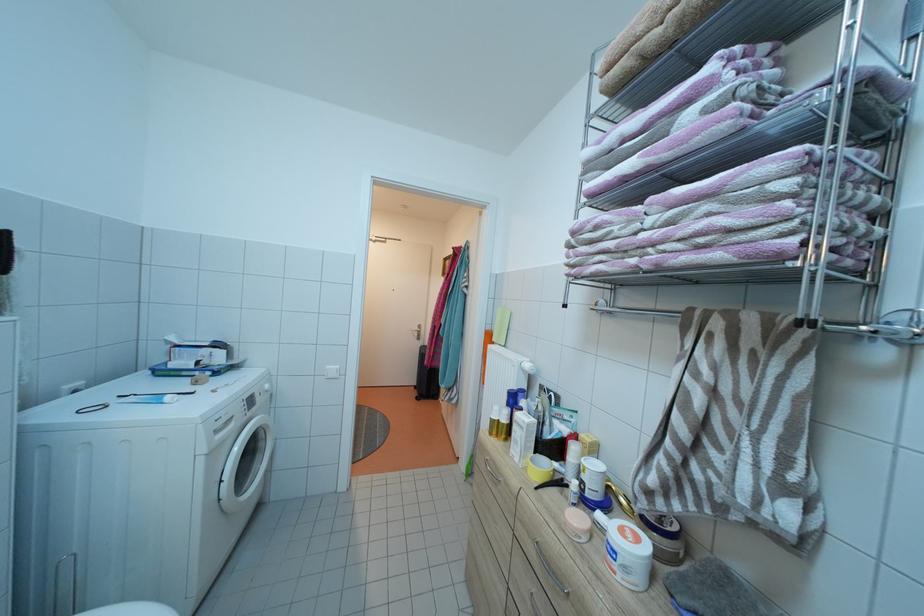
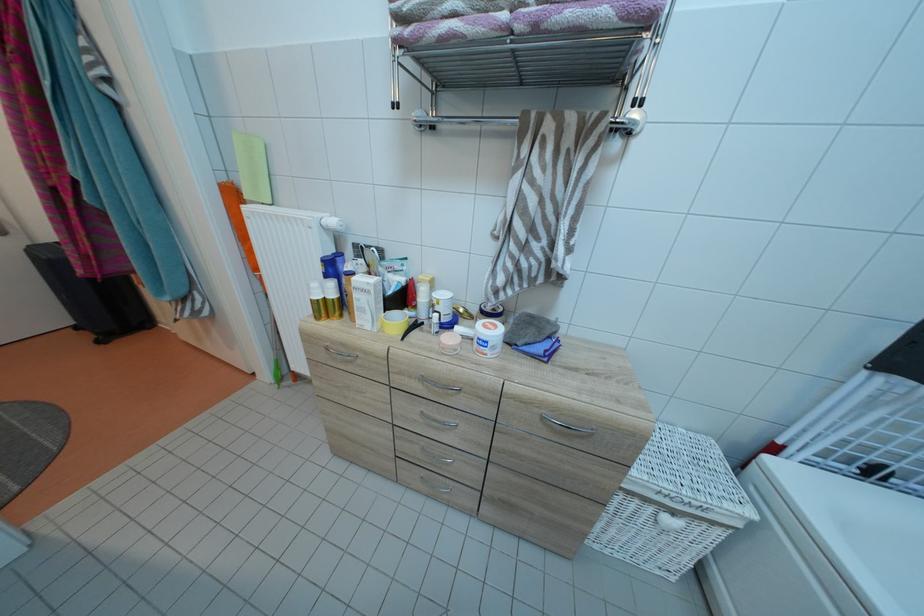
First-person continuous shooting, in which direction is the camera rotating?

The camera rotated toward right-down.